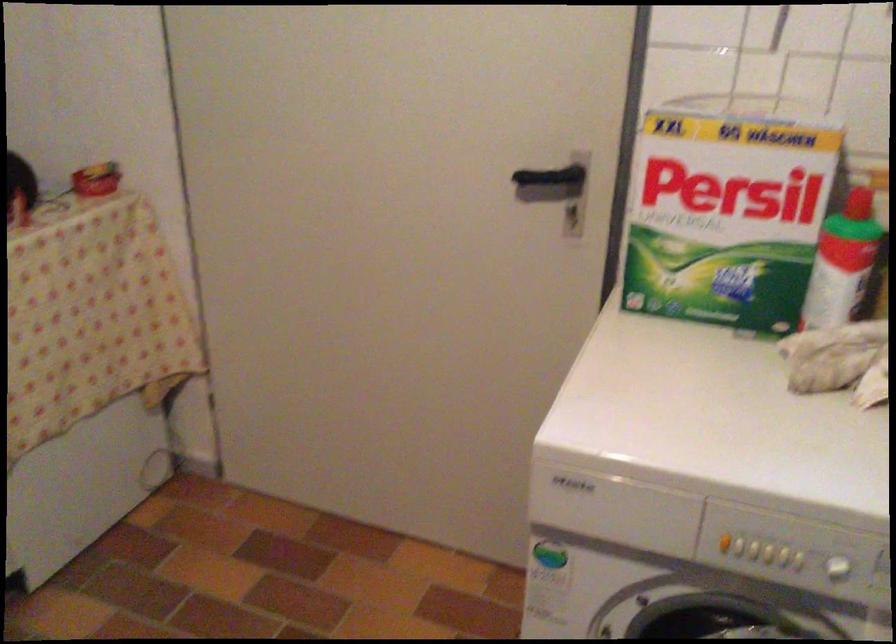
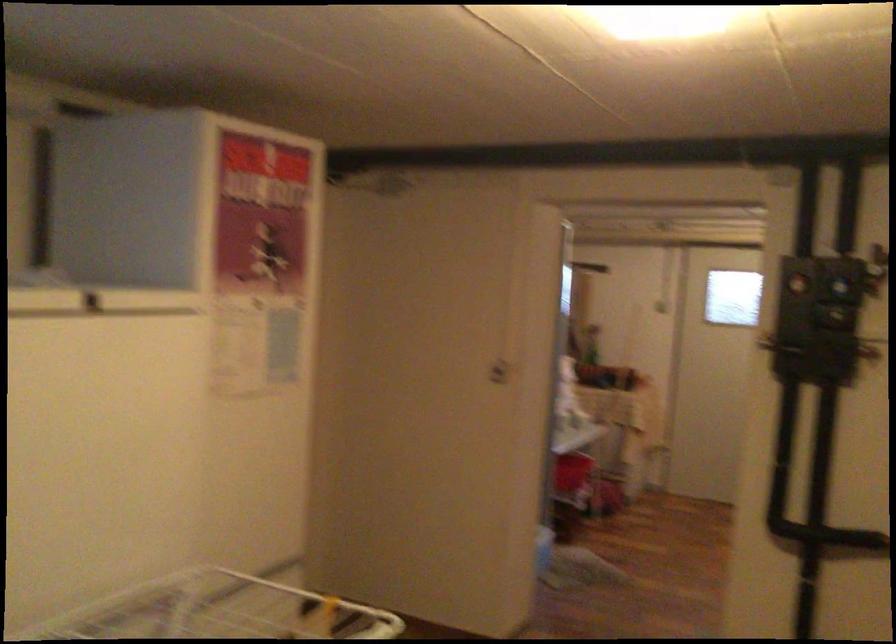
Question: I am providing you with two images of the same scene from different viewpoints. After the viewpoint changes to image2, which objects are now occluded?

Choices:
 (A) black door handle
 (B) blue control dial
 (C) wooden bottle lid
 (D) white door handle

Answer: (A)